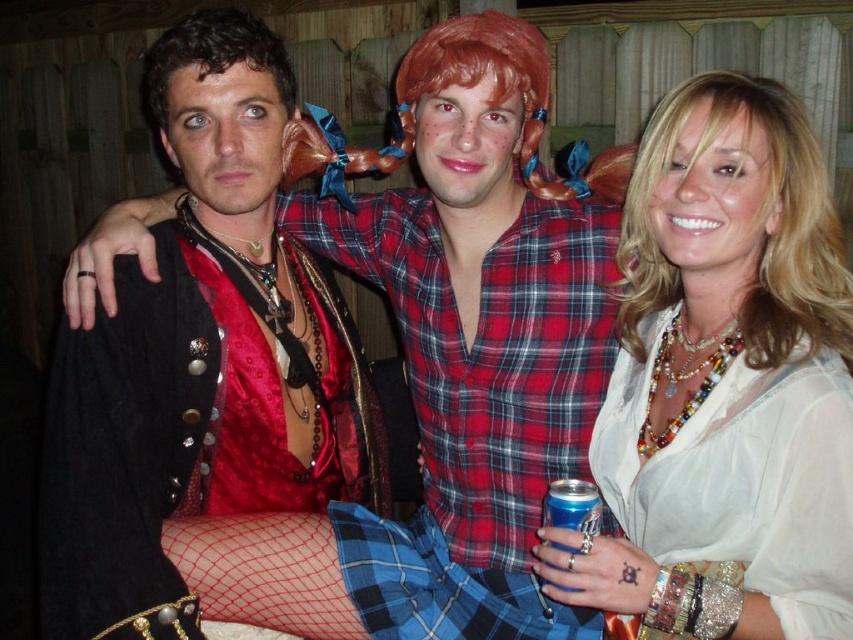
You are taking a photo of three people standing near a wooden fence. You notice two points marked in the image at coordinates point (653, 131) and point (213, 40). Which point is closer to the camera?

Point (653, 131) is closer to the camera than point (213, 40).

You are a photographer trying to adjust the lighting for a photo shoot. You need to place a spotlight at the coordinates of the blonde synthetic wig at upper right. What coordinates should you set the spotlight to?

The coordinates for the blonde synthetic wig at upper right are 0.336 in the x direction and 0.892 in the y direction, so you should set the spotlight to those coordinates.